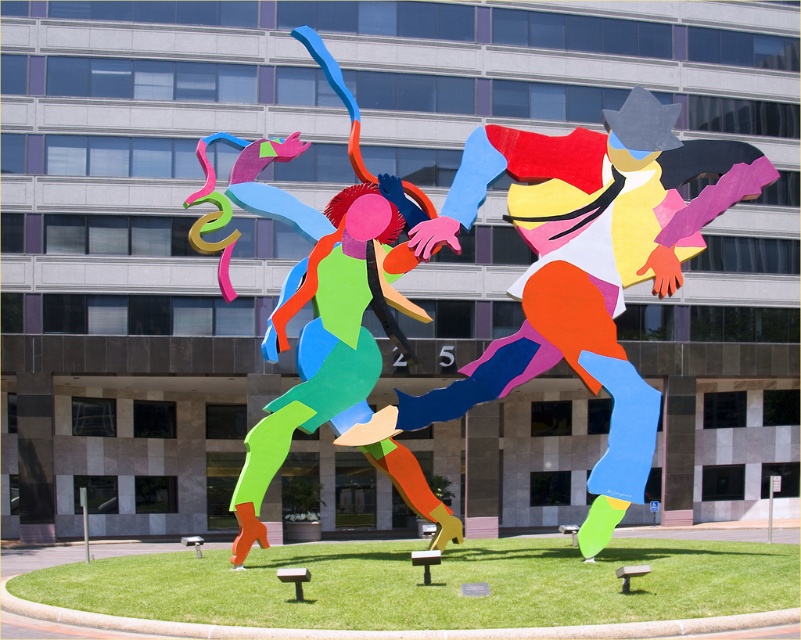
Question: Among these points, which one is nearest to the camera?

Choices:
 (A) click(598, 264)
 (B) click(367, 230)

Answer: (A)

Question: Is matte plastic figure at right positioned before matte plastic sculpture at center?

Choices:
 (A) no
 (B) yes

Answer: (B)

Question: Can you confirm if matte plastic figure at right is wider than matte plastic sculpture at center?

Choices:
 (A) no
 (B) yes

Answer: (B)

Question: Can you confirm if matte plastic figure at right is positioned below matte plastic sculpture at center?

Choices:
 (A) yes
 (B) no

Answer: (A)